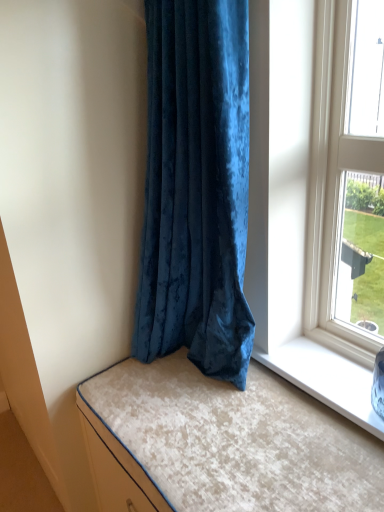
Where is `free spot below velvet blue curtain at center (from a real-world perspective)`? The image size is (384, 512). free spot below velvet blue curtain at center (from a real-world perspective) is located at coordinates (200, 372).